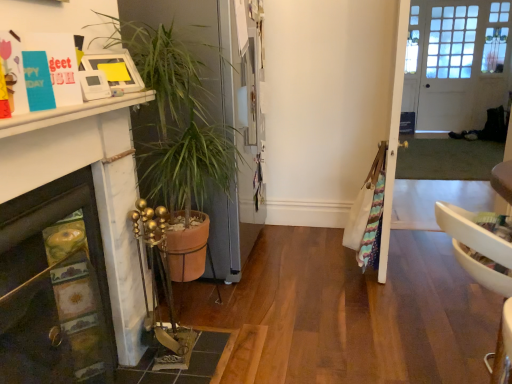
You are a GUI agent. You are given a task and a screenshot of the screen. Output one action in this format:
    pyautogui.click(x=<x>, y=<y>)
    Task: Click on the vacant space behind matte brown tile at lower left
    This screenshot has height=384, width=512.
    Given the screenshot: What is the action you would take?
    pyautogui.click(x=215, y=302)